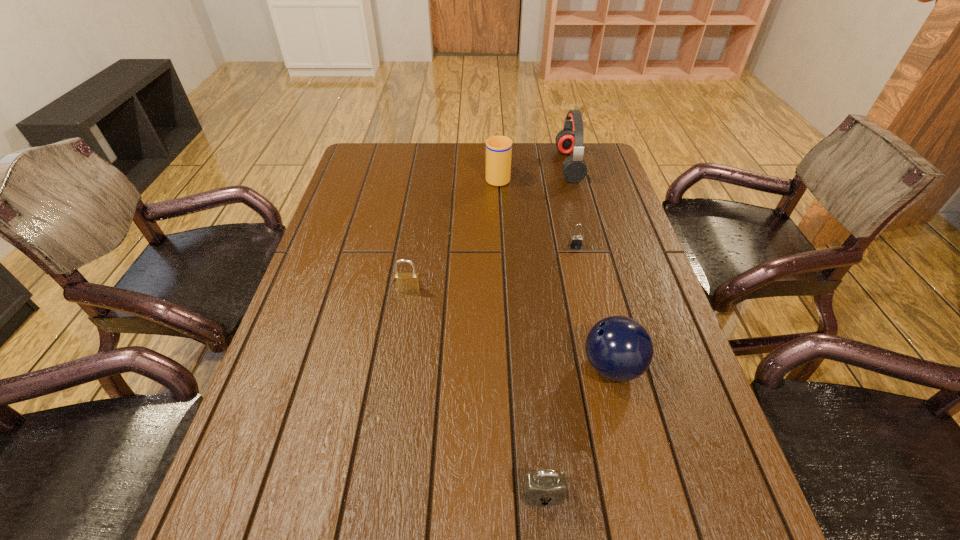
Image resolution: width=960 pixels, height=540 pixels. In order to click on the tallest object in this screenshot , I will do `click(569, 140)`.

I want to click on cup, so click(x=498, y=148).

In order to click on bowling ball in this screenshot , I will do `click(619, 348)`.

In order to click on the leftmost padlock in this screenshot , I will do `click(404, 282)`.

I want to click on the leftmost object, so click(404, 282).

At what (x,y) coordinates should I click in order to perform the action: click on the nearest padlock. Please return your answer as a coordinate pair (x, y). This screenshot has height=540, width=960. Looking at the image, I should click on (546, 487).

The image size is (960, 540). What are the coordinates of `the nearest object` in the screenshot? It's located at (546, 487).

Identify the location of the shortest object. (576, 241).

Find the location of a particular element. This screenshot has height=540, width=960. the farthest padlock is located at coordinates (576, 241).

Locate an element on the screen. Image resolution: width=960 pixels, height=540 pixels. free space located 0.180m on the ear cups of the earphone is located at coordinates (507, 165).